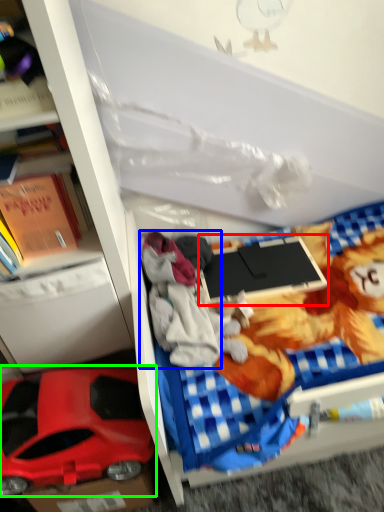
Question: Estimate the real-world distances between objects in this image. Which object is farther from laptop (highlighted by a red box), clothing (highlighted by a blue box) or car (highlighted by a green box)?

Choices:
 (A) clothing
 (B) car

Answer: (B)